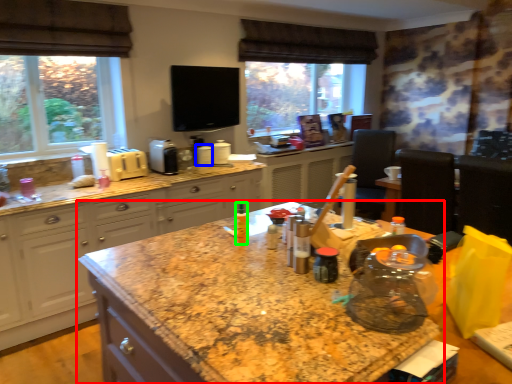
Question: Considering the real-world distances, which object is farthest from countertop (highlighted by a red box)? appliance (highlighted by a blue box) or bottle (highlighted by a green box)?

Choices:
 (A) appliance
 (B) bottle

Answer: (A)